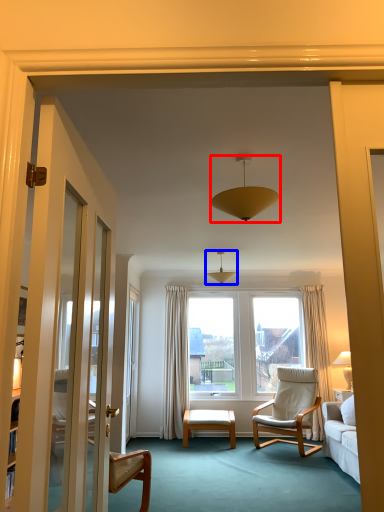
Question: Which point is further to the camera, lamp (highlighted by a red box) or light fixture (highlighted by a blue box)?

Choices:
 (A) lamp
 (B) light fixture

Answer: (B)